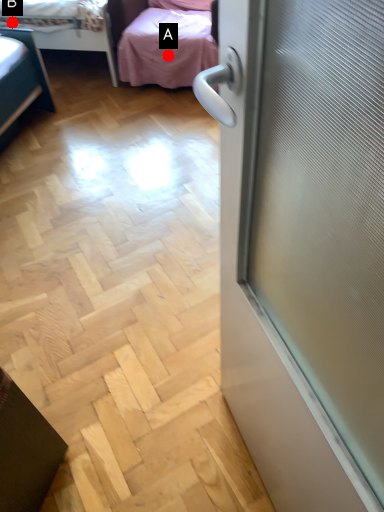
Question: Two points are circled on the image, labeled by A and B beside each circle. Which point appears closest to the camera in this image?

Choices:
 (A) A is closer
 (B) B is closer

Answer: (B)